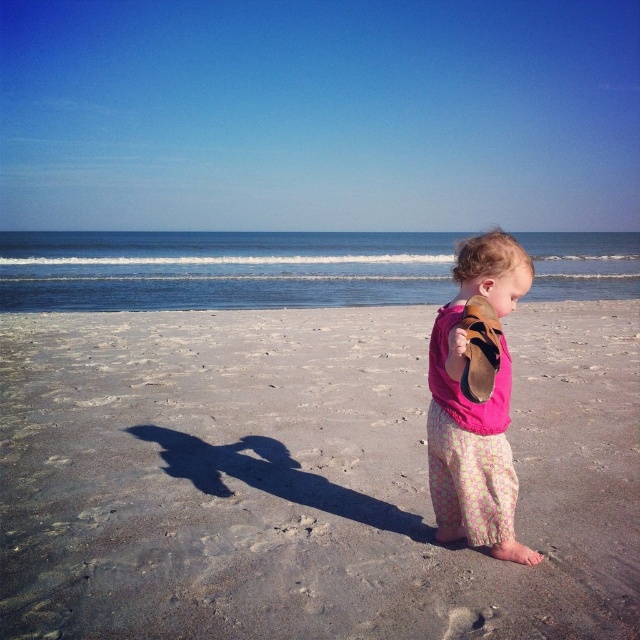
Question: Can you confirm if smooth sand at center is smaller than pink fabric shoe at right?

Choices:
 (A) no
 (B) yes

Answer: (A)

Question: Does smooth sand at center appear over pink fabric shoe at right?

Choices:
 (A) no
 (B) yes

Answer: (A)

Question: Is smooth sand at center positioned behind pink fabric shoe at right?

Choices:
 (A) no
 (B) yes

Answer: (B)

Question: Which point appears closest to the camera in this image?

Choices:
 (A) (588, 316)
 (B) (452, 500)

Answer: (B)